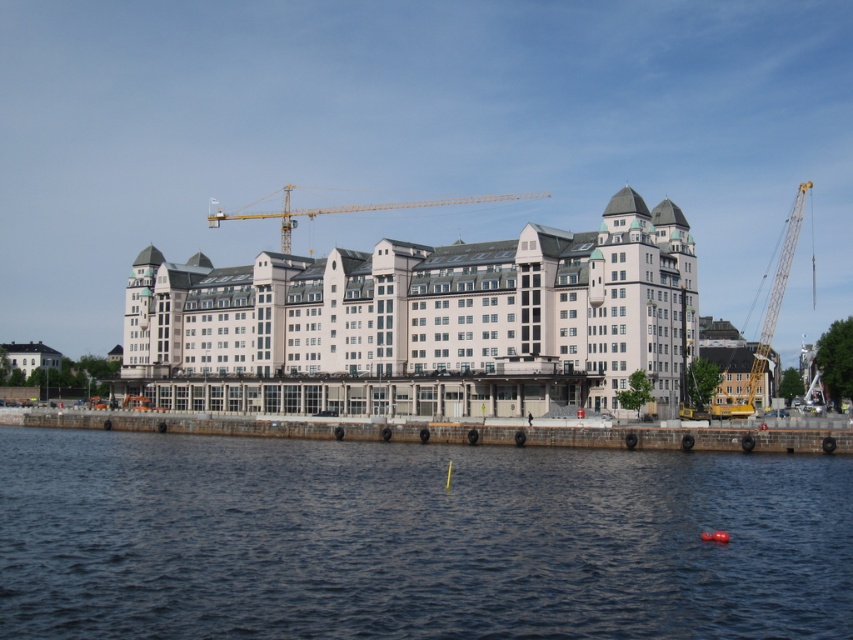
You are a photographer planning to take a wide shot of the waterfront scene. You want to ensure both the white smooth building at center and the yellow metallic crane at center are clearly visible in your photo. Based on their sizes, which object should appear bigger in your final image?

The white smooth building at center should appear bigger in the final image because it is larger in size than the yellow metallic crane at center according to the description.

You are standing on the embankment and want to move from the yellow metallic crane at right to the yellow metallic crane at center. Which direction should you move to reach it?

You should move towards the left to reach the yellow metallic crane at center from the yellow metallic crane at right because the yellow metallic crane at right is positioned under the yellow metallic crane at center.